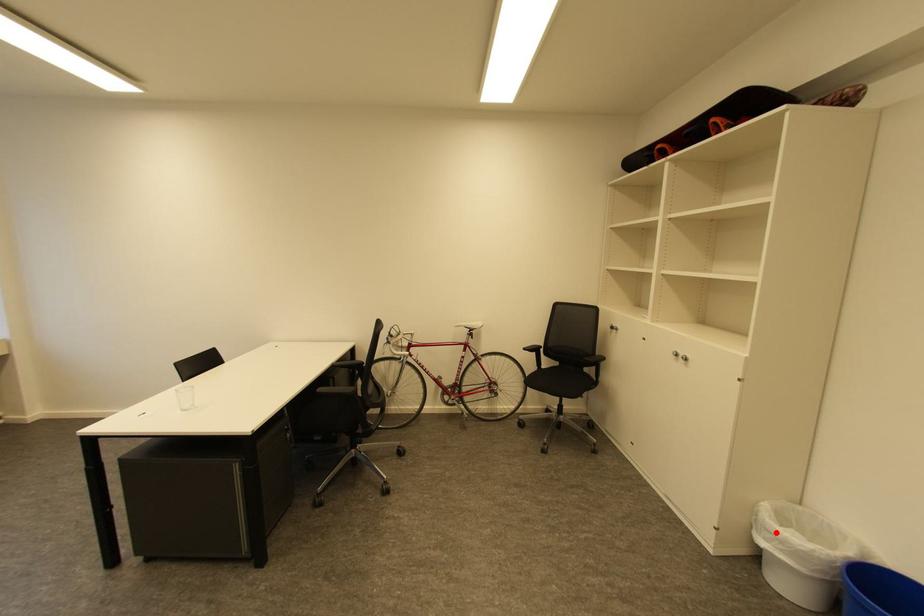
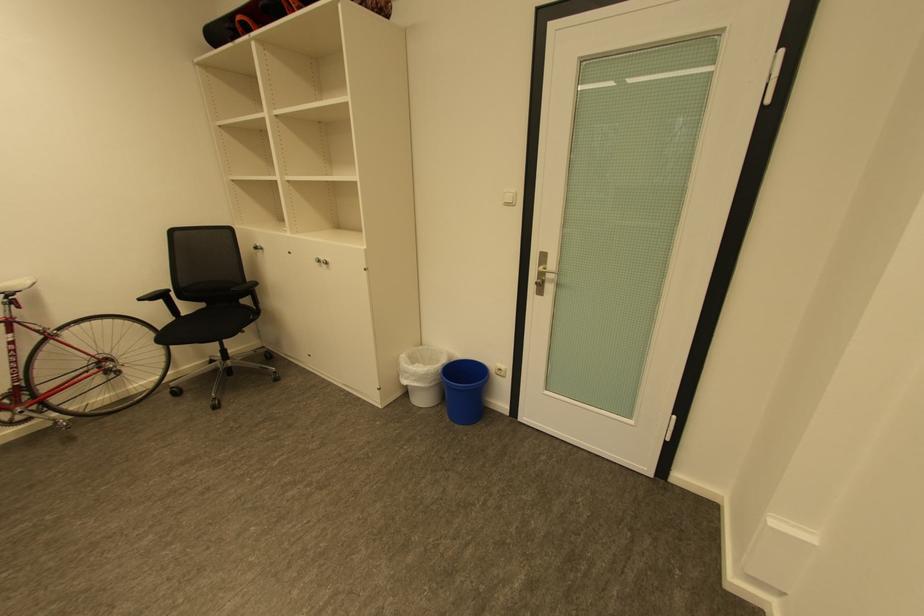
In the second image, find the point that corresponds to the highlighted location in the first image.

(414, 373)